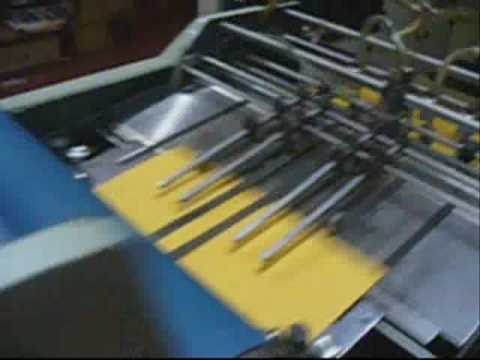
I want to click on rod, so pyautogui.click(x=418, y=182).